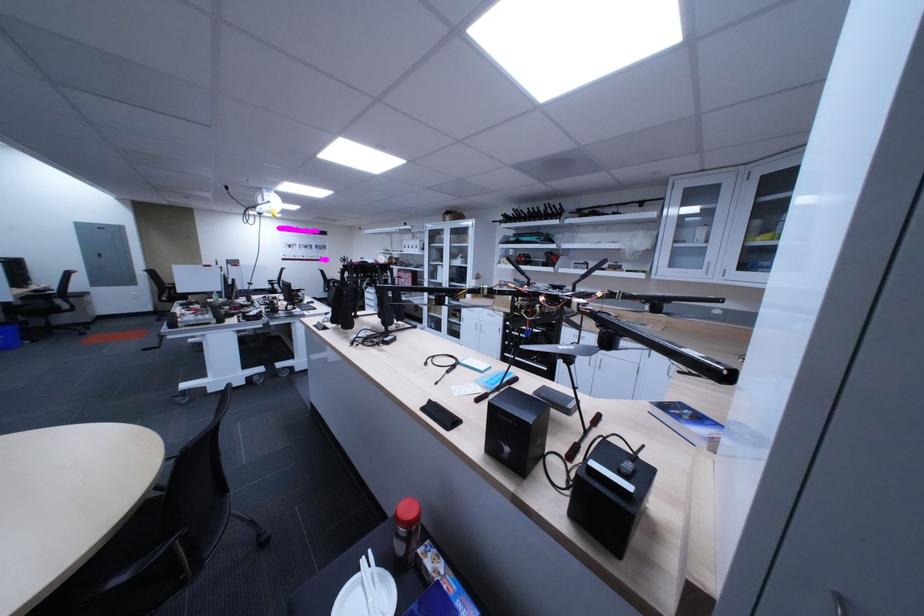
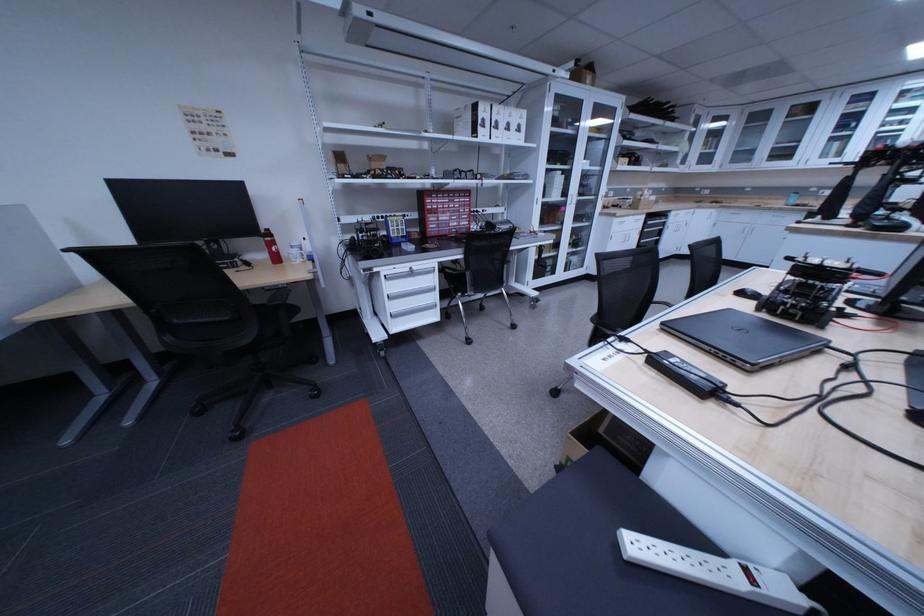
Where in the second image is the point corresponding to [428,249] from the first image?

(524, 130)